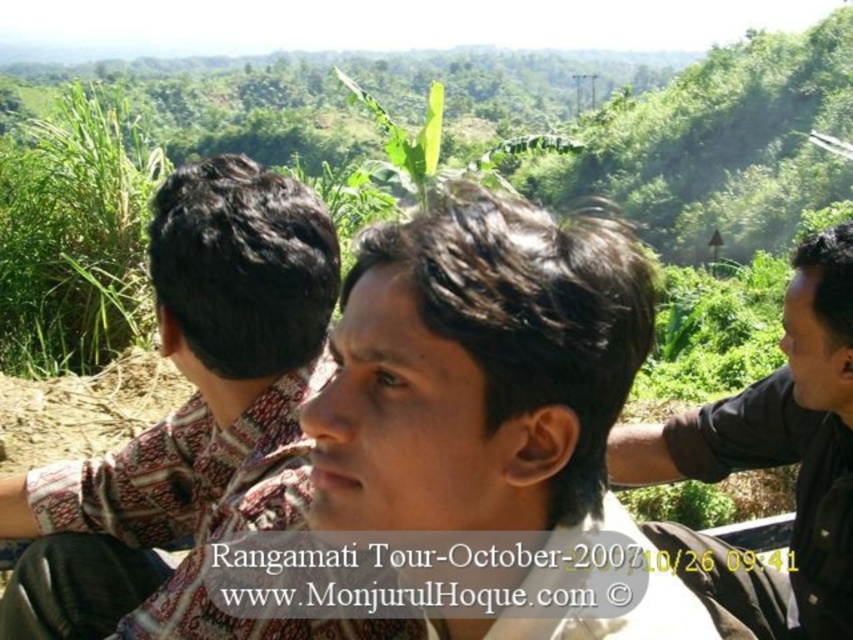
Who is shorter, brown woven shirt at left or black matte shirt at right?

black matte shirt at right

Who is positioned more to the left, brown woven shirt at left or black matte shirt at right?

From the viewer's perspective, brown woven shirt at left appears more on the left side.

What do you see at coordinates (187, 404) in the screenshot? I see `brown woven shirt at left` at bounding box center [187, 404].

Locate an element on the screen. The height and width of the screenshot is (640, 853). brown woven shirt at left is located at coordinates (187, 404).

Can you confirm if green leafy plant at center is smaller than brown woven shirt at left?

No, green leafy plant at center is not smaller than brown woven shirt at left.

Does green leafy plant at center appear on the right side of brown woven shirt at left?

Incorrect, green leafy plant at center is not on the right side of brown woven shirt at left.

At what (x,y) coordinates should I click in order to perform the action: click on green leafy plant at center. Please return your answer as a coordinate pair (x, y). Looking at the image, I should click on (663, 134).

The image size is (853, 640). What are the coordinates of `green leafy plant at center` in the screenshot? It's located at (663, 134).

Is point (503, 324) closer to viewer compared to point (809, 417)?

Yes.

Does brown printed shirt at center appear over black matte shirt at right?

Yes, brown printed shirt at center is above black matte shirt at right.

Which is in front, point (395, 420) or point (817, 534)?

Point (395, 420)

The image size is (853, 640). Find the location of `brown printed shirt at center`. brown printed shirt at center is located at coordinates (485, 426).